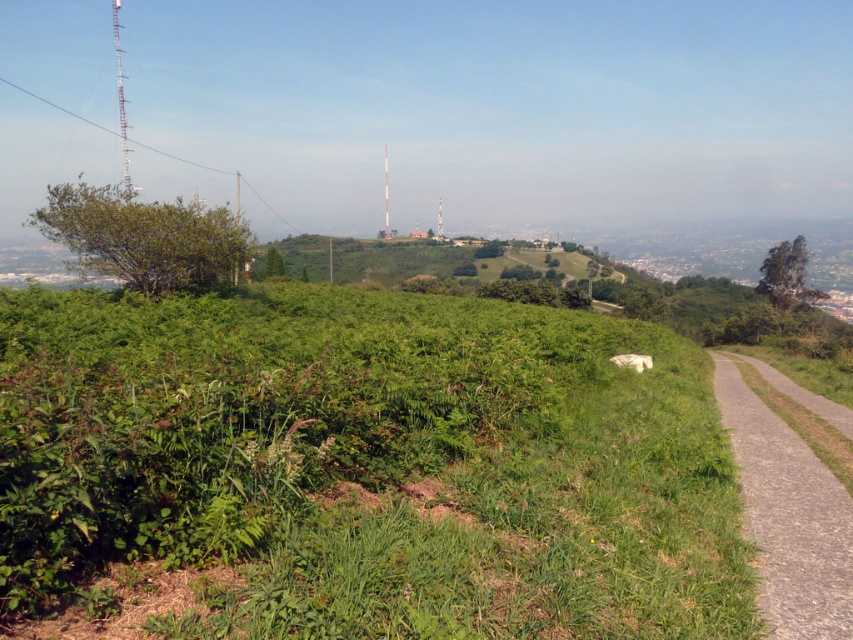
The height and width of the screenshot is (640, 853). What do you see at coordinates (363, 468) in the screenshot?
I see `green leafy grass at center` at bounding box center [363, 468].

Can you confirm if green leafy grass at center is bigger than gray gravel path at right?

Indeed, green leafy grass at center has a larger size compared to gray gravel path at right.

Is point (428, 339) more distant than point (762, 426)?

No, it is not.

Where is `green leafy grass at center`? The image size is (853, 640). green leafy grass at center is located at coordinates (363, 468).